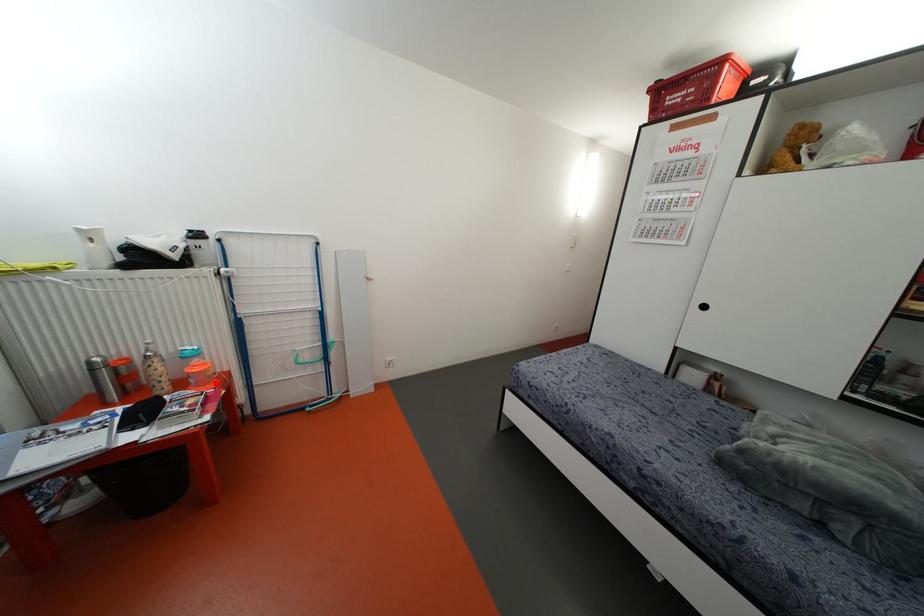
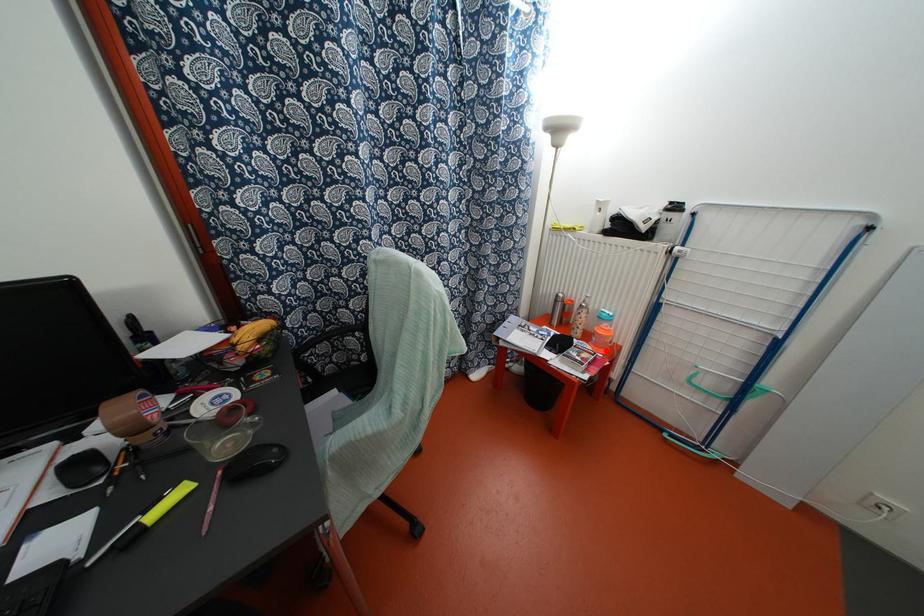
I am providing you with two images of the same scene from different viewpoints. A red point is marked on the first image and another point is marked on the second image. Is the red point in image1 aligned with the point shown in image2?

Yes